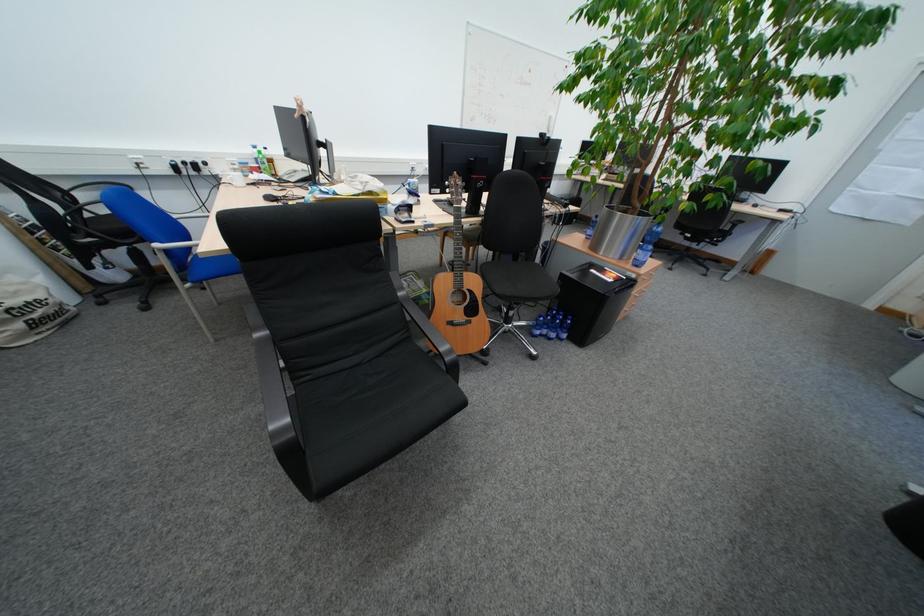
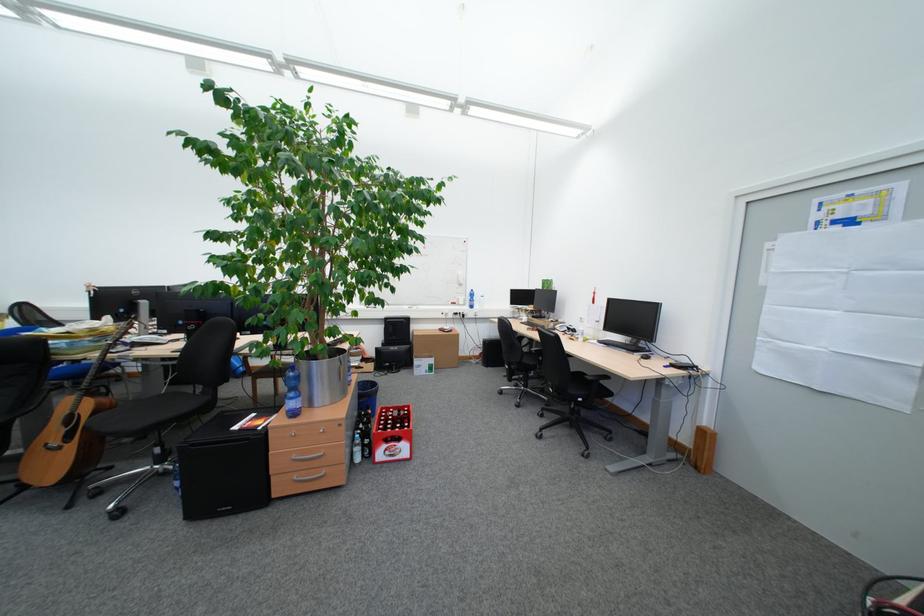
Find the pixel in the second image that matches (475,320) in the first image.

(68, 445)